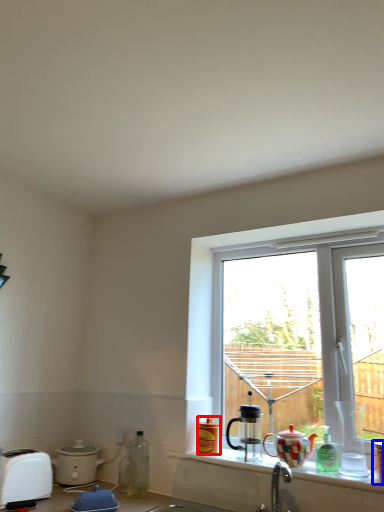
Question: Among these objects, which one is farthest to the camera, bottle (highlighted by a red box) or coffee cup (highlighted by a blue box)?

Choices:
 (A) bottle
 (B) coffee cup

Answer: (A)